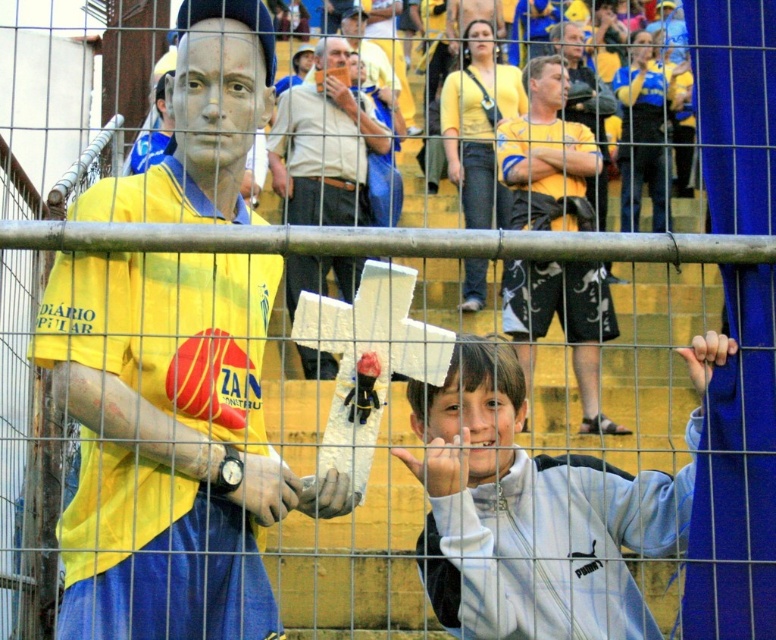
Question: Can you confirm if matte yellow shirt at center is positioned to the left of matte white mask at center?

Choices:
 (A) no
 (B) yes

Answer: (A)

Question: From the image, what is the correct spatial relationship of white matte jacket at lower right in relation to yellow jersey at center?

Choices:
 (A) left
 (B) right

Answer: (A)

Question: Which point is closer to the camera taking this photo?

Choices:
 (A) pyautogui.click(x=593, y=196)
 (B) pyautogui.click(x=317, y=260)
 (C) pyautogui.click(x=125, y=369)
 (D) pyautogui.click(x=435, y=458)

Answer: (D)

Question: Is yellow matte shirt at left bigger than matte yellow shirt at center?

Choices:
 (A) no
 (B) yes

Answer: (A)

Question: Which of these objects is positioned farthest from the yellow jersey at center?

Choices:
 (A) matte white mask at center
 (B) white matte jacket at lower right
 (C) yellow matte shirt at left

Answer: (C)

Question: Which point is farther to the camera?

Choices:
 (A) (534, 308)
 (B) (120, 556)
 (C) (345, 64)

Answer: (C)